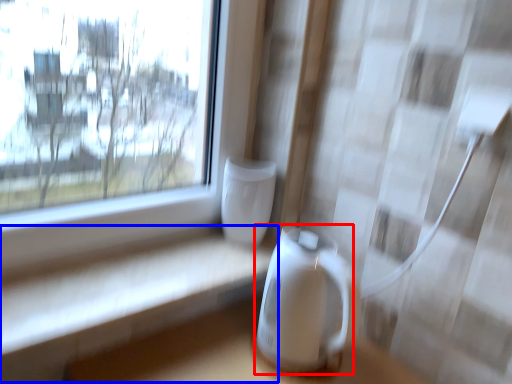
Question: Which point is further to the camera, appliance (highlighted by a red box) or table (highlighted by a blue box)?

Choices:
 (A) appliance
 (B) table

Answer: (A)